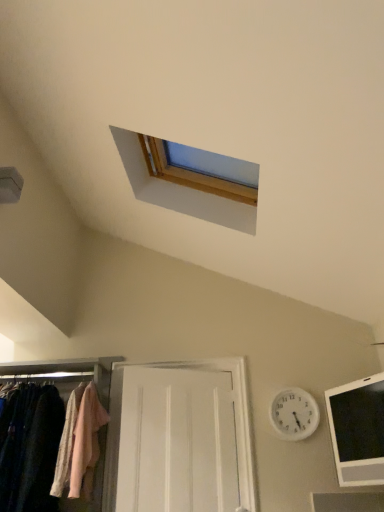
Question: In terms of width, does white plastic clock at upper center look wider or thinner when compared to white wooden door at center?

Choices:
 (A) thin
 (B) wide

Answer: (A)

Question: Is white plastic clock at upper center inside or outside of white wooden door at center?

Choices:
 (A) inside
 (B) outside

Answer: (B)

Question: Estimate the real-world distances between objects in this image. Which object is closer to the matte fabric closet at lower left?

Choices:
 (A) white plastic clock at upper center
 (B) black glossy tablet at lower right
 (C) white wooden door at center
 (D) light pink fabric at left

Answer: (D)

Question: Which is farther from the light pink fabric at left?

Choices:
 (A) matte fabric closet at lower left
 (B) white plastic clock at upper center
 (C) black glossy tablet at lower right
 (D) white wooden door at center

Answer: (C)